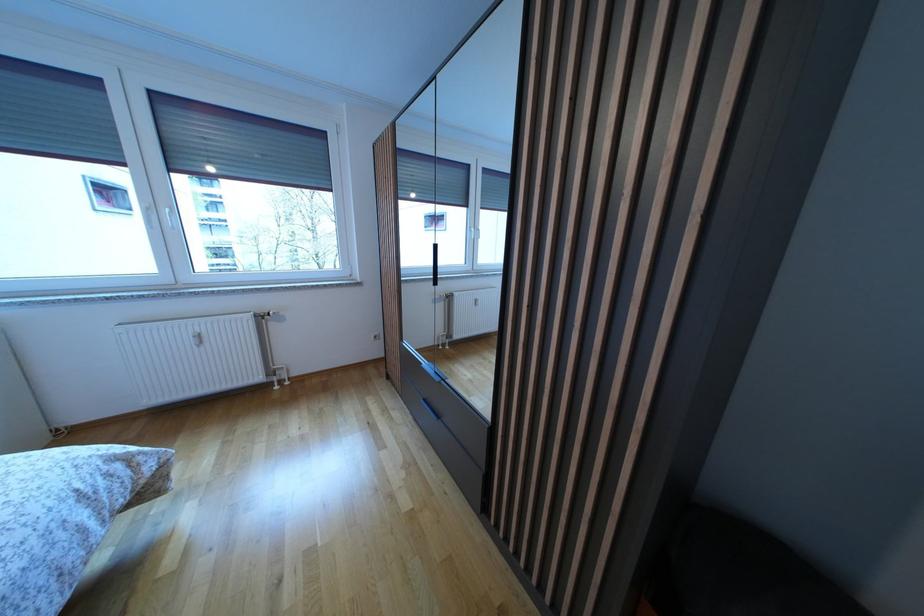
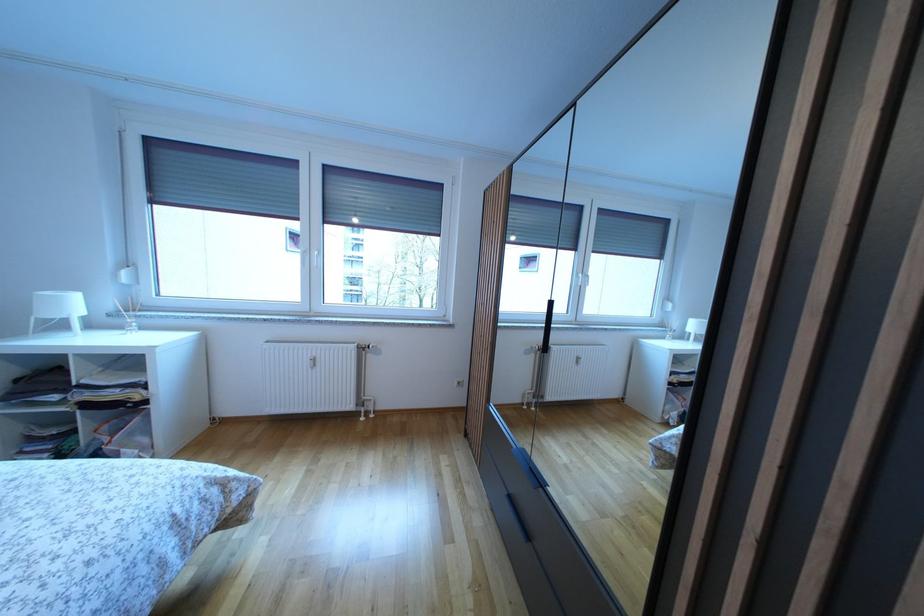
Question: The first image is from the beginning of the video and the second image is from the end. How did the camera likely rotate when shooting the video?

Choices:
 (A) Left
 (B) Right
 (C) Up
 (D) Down

Answer: (A)